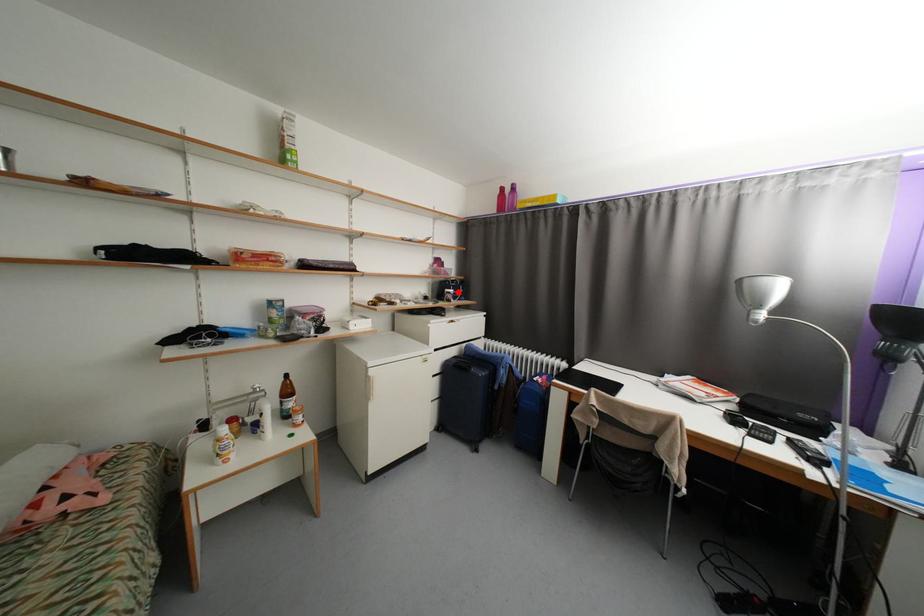
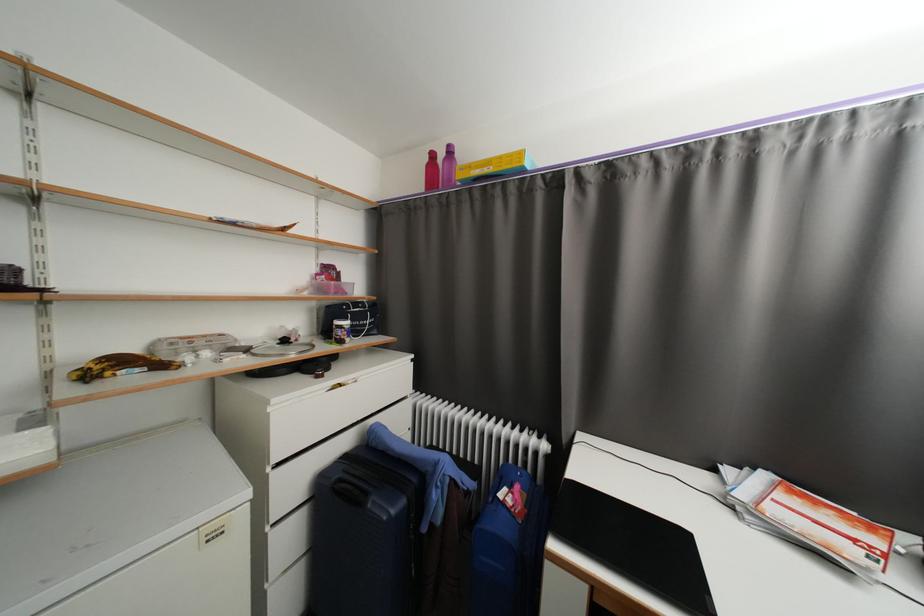
Locate, in the second image, the point that corresponds to the highlighted location in the first image.

(353, 323)